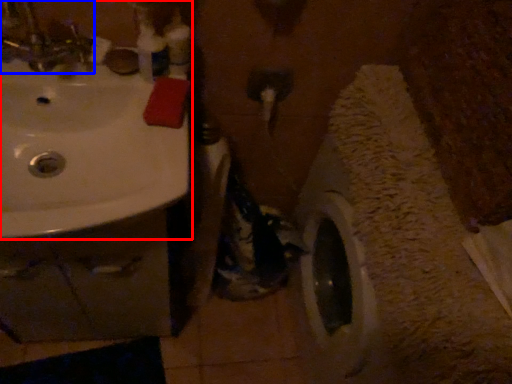
Question: Which object appears farthest to the camera in this image, sink (highlighted by a red box) or tap (highlighted by a blue box)?

Choices:
 (A) sink
 (B) tap

Answer: (A)